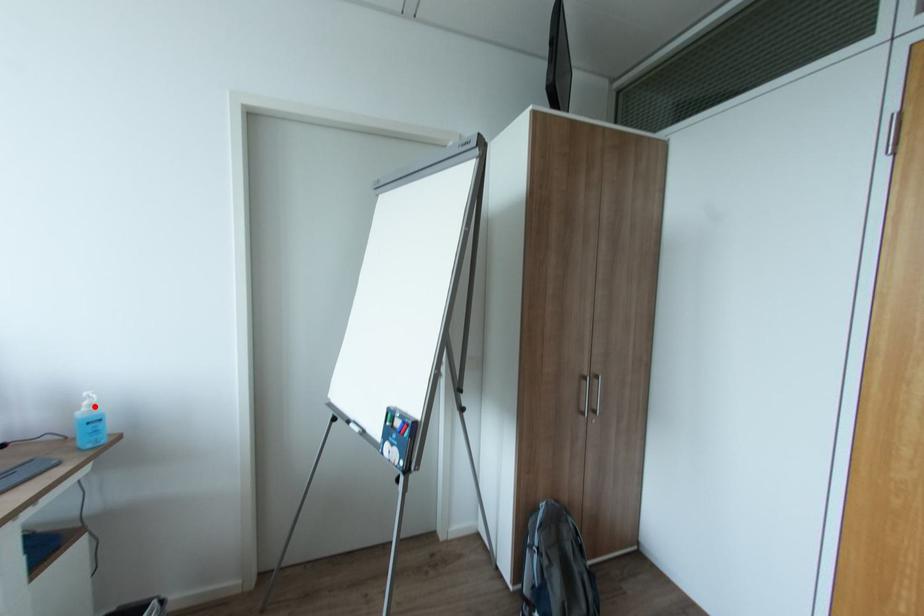
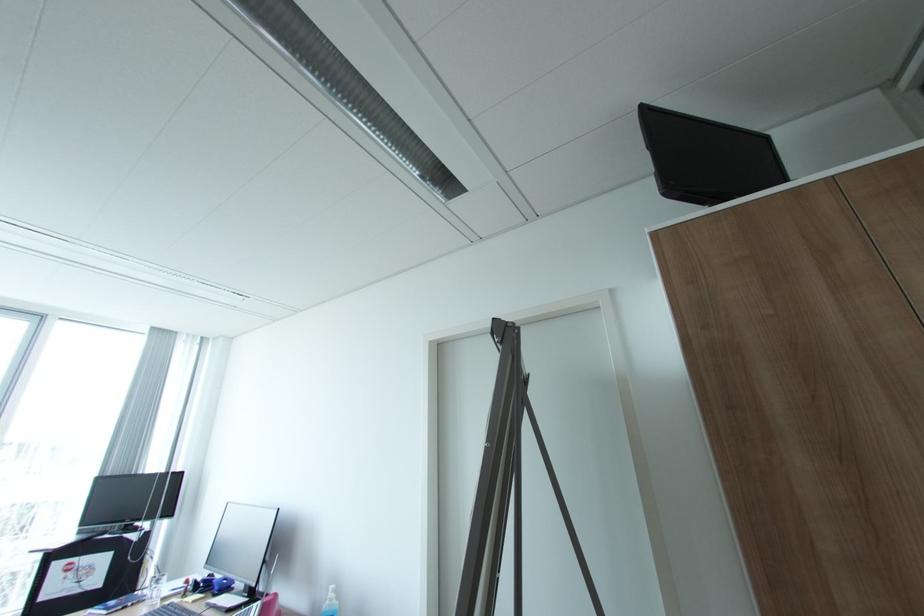
Find the pixel in the second image that matches the highlighted location in the first image.

(336, 599)